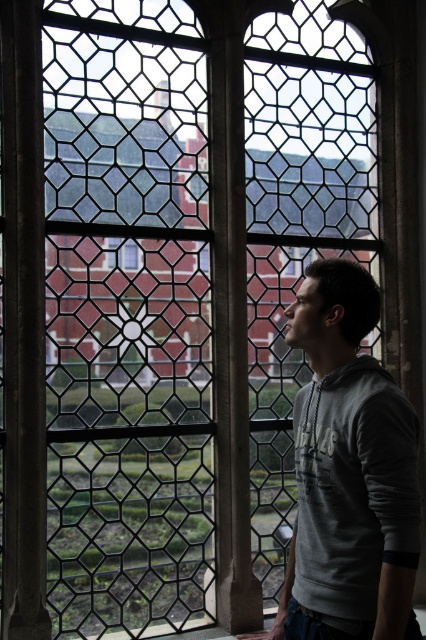
Who is positioned more to the right, dark gray stone pillar at left or clear glass window at center?

From the viewer's perspective, clear glass window at center appears more on the right side.

Who is more distant from viewer, [34,472] or [129,246]?

Positioned behind is point [129,246].

At what (x,y) coordinates should I click in order to perform the action: click on dark gray stone pillar at left. Please return your answer as a coordinate pair (x, y). Image resolution: width=426 pixels, height=640 pixels. Looking at the image, I should click on (23, 323).

From the picture: Can you confirm if gray hoodie at center is smaller than dark gray stone pillar at left?

No, gray hoodie at center is not smaller than dark gray stone pillar at left.

Between point (394, 520) and point (9, 618), which one is positioned in front?

Positioned in front is point (394, 520).

Image resolution: width=426 pixels, height=640 pixels. I want to click on gray hoodie at center, so click(x=348, y=474).

Between gray hoodie at center and clear glass window at center, which one is positioned lower?

Positioned lower is gray hoodie at center.

Does gray hoodie at center have a greater width compared to clear glass window at center?

Yes, gray hoodie at center is wider than clear glass window at center.

Identify the location of gray hoodie at center. (348, 474).